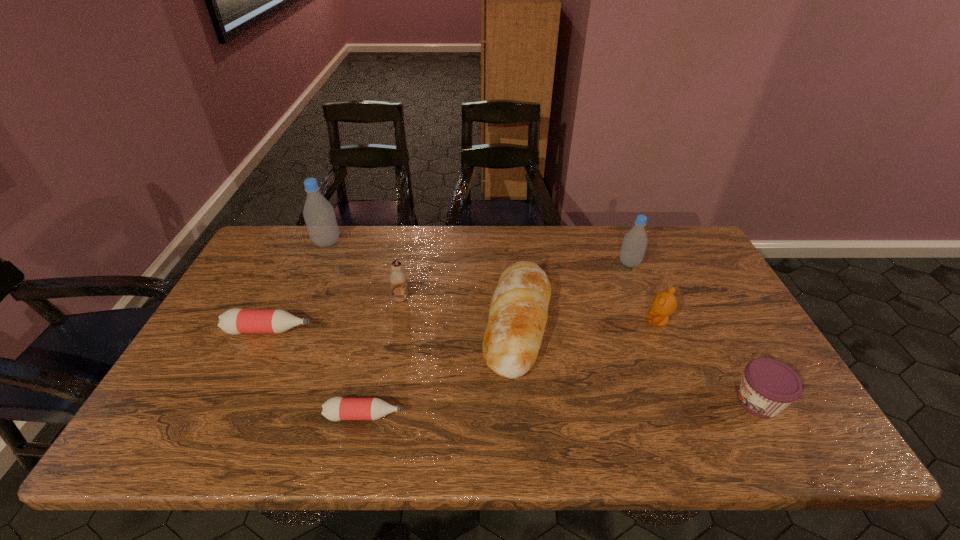
At what (x,y) coordinates should I click in order to perform the action: click on vacant space that's between the bigger pink bottle and the chocolate milk. Please return your answer as a coordinate pair (x, y). This screenshot has height=540, width=960. Looking at the image, I should click on (336, 314).

At what (x,y) coordinates should I click in order to perform the action: click on empty location between the rightmost object and the beige bread. Please return your answer as a coordinate pair (x, y). Image resolution: width=960 pixels, height=540 pixels. Looking at the image, I should click on (638, 362).

Where is `vacant area that lies between the bigger gray bottle and the chocolate milk`? vacant area that lies between the bigger gray bottle and the chocolate milk is located at coordinates [364, 271].

This screenshot has height=540, width=960. What are the coordinates of `empty space between the bigger pink bottle and the second farthest bottle` in the screenshot? It's located at (449, 297).

This screenshot has height=540, width=960. I want to click on empty space between the nearest bottle and the jam, so click(x=562, y=408).

At what (x,y) coordinates should I click in order to perform the action: click on free space between the bigger pink bottle and the right pink bottle. Please return your answer as a coordinate pair (x, y). Looking at the image, I should click on (318, 373).

Point out which object is positioned as the fourth nearest to the brown teddy bear. Please provide its 2D coordinates. Your answer should be formatted as a tuple, i.e. [(x, y)], where the tuple contains the x and y coordinates of a point satisfying the conditions above.

[(398, 278)]

Image resolution: width=960 pixels, height=540 pixels. In order to click on the seventh closest object to the tallest object in this screenshot , I will do `click(768, 386)`.

Select which bottle is the third closest to the left pink bottle. Please provide its 2D coordinates. Your answer should be formatted as a tuple, i.e. [(x, y)], where the tuple contains the x and y coordinates of a point satisfying the conditions above.

[(635, 241)]

The height and width of the screenshot is (540, 960). In order to click on bottle that is the second closest one to the rightmost object in this screenshot , I will do `click(337, 408)`.